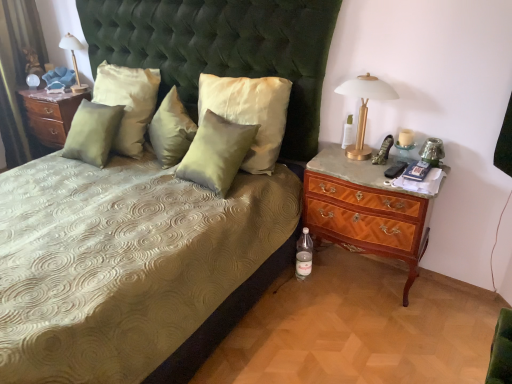
The width and height of the screenshot is (512, 384). I want to click on vacant area situated to the left side of gold metallic table lamp at upper right, the second bedside lamp in the top-to-bottom sequence, so click(329, 162).